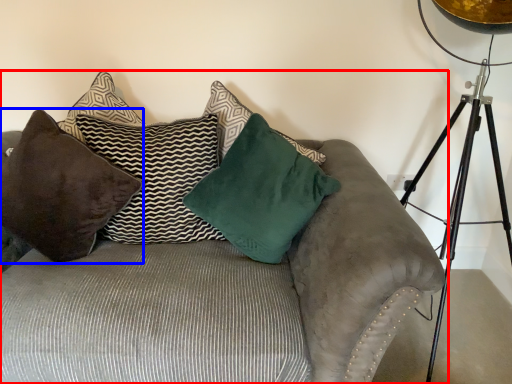
Question: Which object is closer to the camera taking this photo, studio couch (highlighted by a red box) or pillow (highlighted by a blue box)?

Choices:
 (A) studio couch
 (B) pillow

Answer: (A)